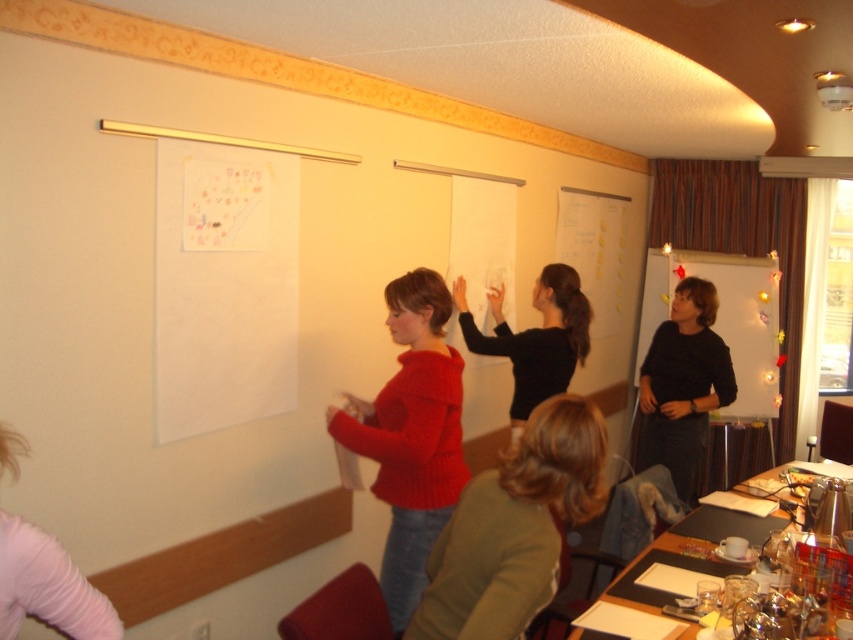
Question: Does green matte sweater at center have a smaller size compared to knitted red sweater at center?

Choices:
 (A) yes
 (B) no

Answer: (A)

Question: Which point is closer to the camera?

Choices:
 (A) white matte whiteboard at center right
 (B) pink fabric shirt at lower left
 (C) knitted red sweater at center

Answer: (B)

Question: Is knitted red sweater at center bigger than black matte shirt at center?

Choices:
 (A) yes
 (B) no

Answer: (B)

Question: Does green matte sweater at center appear over wooden table at lower right?

Choices:
 (A) no
 (B) yes

Answer: (B)

Question: Among these points, which one is farthest from the camera?

Choices:
 (A) click(x=746, y=412)
 (B) click(x=560, y=337)
 (C) click(x=695, y=563)

Answer: (A)

Question: Which object is the closest to the white matte whiteboard at center right?

Choices:
 (A) green matte sweater at center
 (B) wooden table at lower right
 (C) pink fabric shirt at lower left

Answer: (B)